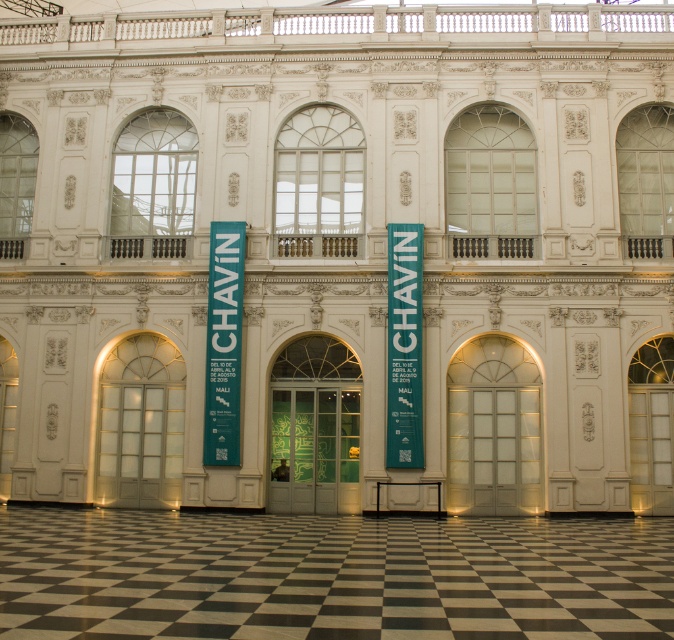
You are an architect analyzing the building facade. Considering the black checkered floor at center and the teal fabric banner at center, which one is shorter in height?

The black checkered floor at center has a lesser height compared to the teal fabric banner at center, so the black checkered floor at center is shorter.

What is the location of the point labeled as point (330, 576) in the grand ornate building?

The point (330, 576) is located on the black checkered floor at center.